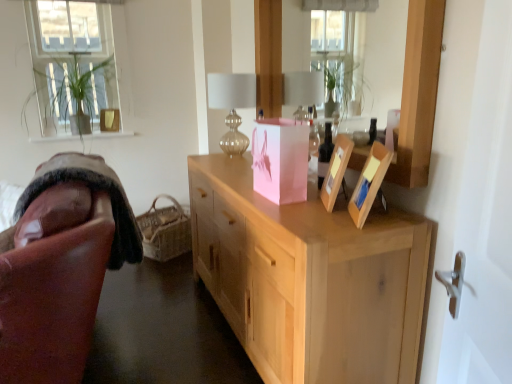
Question: Is leather at left a part of translucent glass table lamp at center?

Choices:
 (A) yes
 (B) no

Answer: (B)

Question: Does translucent glass table lamp at center appear on the right side of leather at left?

Choices:
 (A) yes
 (B) no

Answer: (A)

Question: Does translucent glass table lamp at center have a lesser width compared to leather at left?

Choices:
 (A) yes
 (B) no

Answer: (A)

Question: Is translucent glass table lamp at center positioned beyond the bounds of leather at left?

Choices:
 (A) no
 (B) yes

Answer: (B)

Question: Is translucent glass table lamp at center far from leather at left?

Choices:
 (A) no
 (B) yes

Answer: (A)

Question: Is translucent glass bottle at center taller or shorter than translucent glass table lamp at center?

Choices:
 (A) tall
 (B) short

Answer: (B)

Question: From the image's perspective, is translucent glass bottle at center located above or below translucent glass table lamp at center?

Choices:
 (A) above
 (B) below

Answer: (B)

Question: Is point (329, 147) positioned closer to the camera than point (236, 145)?

Choices:
 (A) closer
 (B) farther

Answer: (A)

Question: In terms of size, does translucent glass bottle at center appear bigger or smaller than translucent glass table lamp at center?

Choices:
 (A) small
 (B) big

Answer: (A)

Question: Considering their positions, is wooden mirror at upper center located in front of or behind translucent glass bottle at center?

Choices:
 (A) front
 (B) behind

Answer: (A)

Question: From the image's perspective, relative to translucent glass bottle at center, is wooden mirror at upper center above or below?

Choices:
 (A) above
 (B) below

Answer: (A)

Question: In terms of width, does wooden mirror at upper center look wider or thinner when compared to translucent glass bottle at center?

Choices:
 (A) thin
 (B) wide

Answer: (B)

Question: In the image, is wooden mirror at upper center on the left side or the right side of translucent glass bottle at center?

Choices:
 (A) left
 (B) right

Answer: (A)

Question: Is translucent glass bottle at center spatially inside pink paper bag at center, or outside of it?

Choices:
 (A) inside
 (B) outside

Answer: (B)

Question: Considering their positions, is translucent glass bottle at center located in front of or behind pink paper bag at center?

Choices:
 (A) behind
 (B) front

Answer: (A)